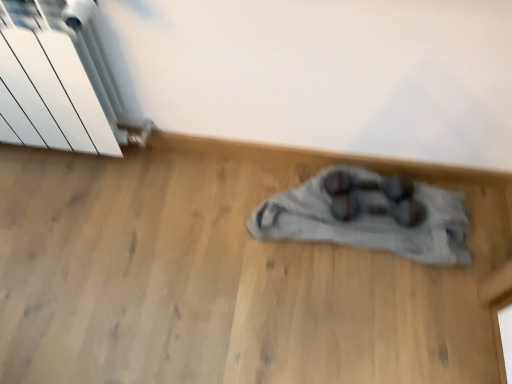
The height and width of the screenshot is (384, 512). Find the location of `empty space that is to the right of shiny black dumbbells at center`. empty space that is to the right of shiny black dumbbells at center is located at coordinates (436, 218).